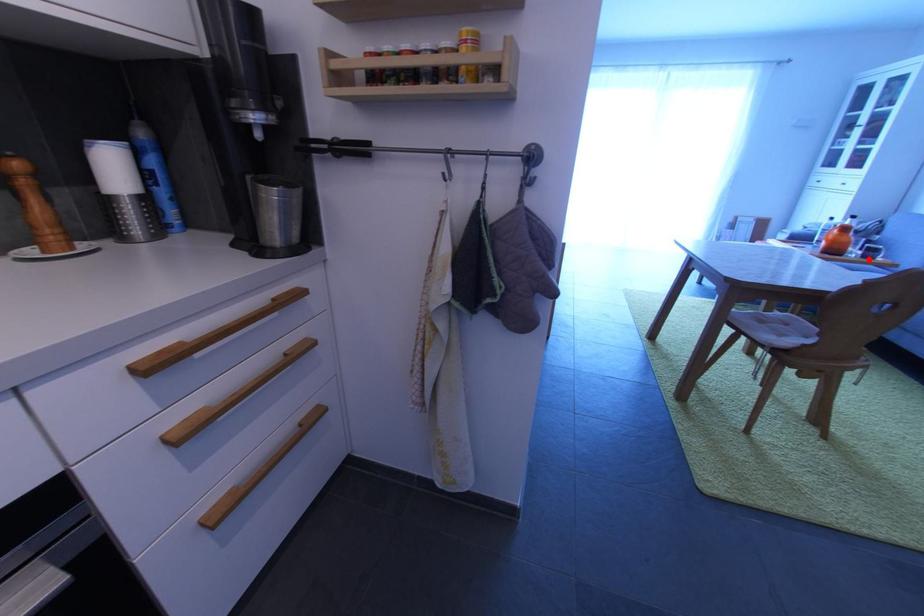
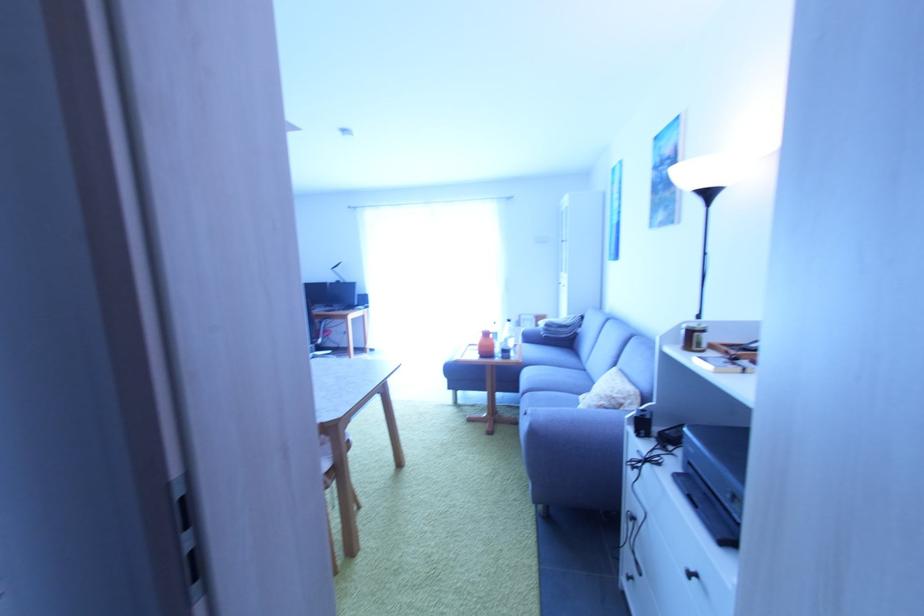
Question: A red point is marked in image1. In image2, is the corresponding 3D point closer to the camera or farther? Reply with the corresponding letter.

Choices:
 (A) The corresponding 3D point is closer.
 (B) The corresponding 3D point is farther.

Answer: (A)